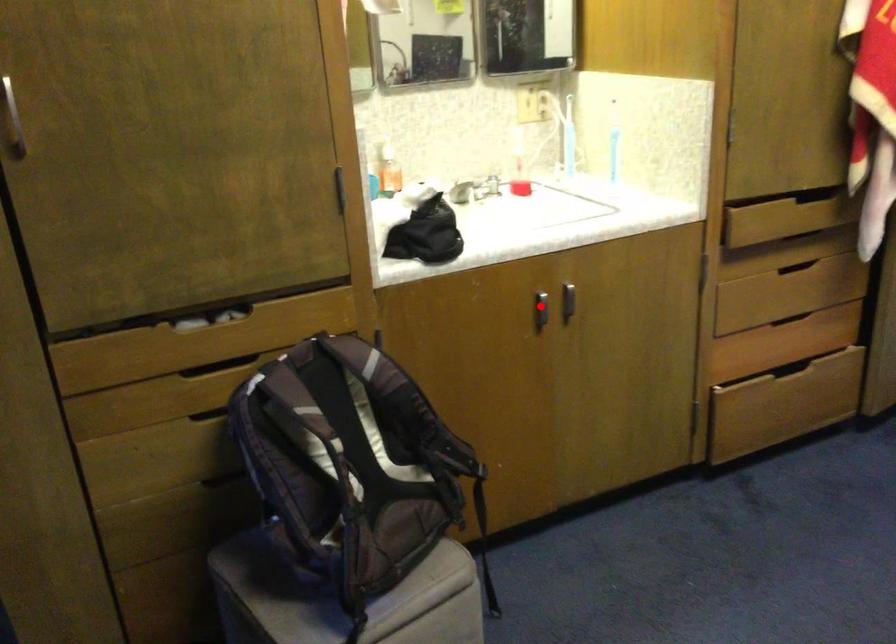
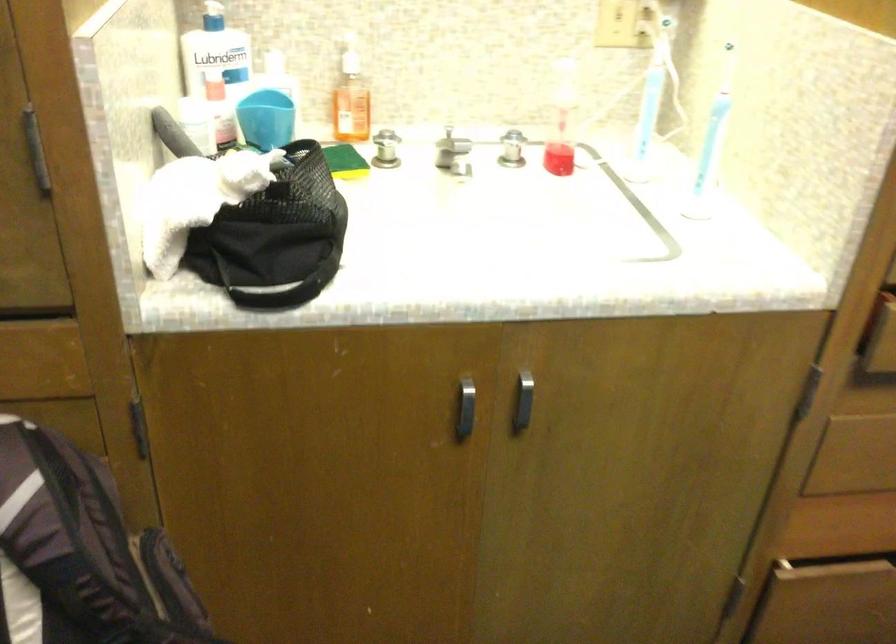
Question: I am providing you with two images of the same scene from different viewpoints. A red point is shown in image1. For the corresponding object point in image2, is it positioned nearer or farther from the camera?

Choices:
 (A) Nearer
 (B) Farther

Answer: (A)